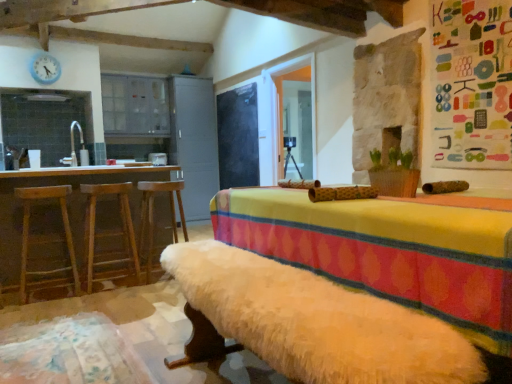
Question: Considering the relative positions of transparent glass door at center and wooden bar stool at left, marked as the 3th bar stool in a right-to-left arrangement, in the image provided, is transparent glass door at center behind wooden bar stool at left, marked as the 3th bar stool in a right-to-left arrangement,?

Choices:
 (A) yes
 (B) no

Answer: (A)

Question: Is wooden bar stool at left, the 1th bar stool from the left, completely or partially inside transparent glass door at center?

Choices:
 (A) yes
 (B) no

Answer: (B)

Question: Considering the relative sizes of transparent glass door at center and wooden bar stool at left, the 1th bar stool from the left, in the image provided, is transparent glass door at center thinner than wooden bar stool at left, the 1th bar stool from the left,?

Choices:
 (A) yes
 (B) no

Answer: (A)

Question: From the image's perspective, is transparent glass door at center under wooden bar stool at left, marked as the 3th bar stool in a right-to-left arrangement?

Choices:
 (A) yes
 (B) no

Answer: (B)

Question: Is transparent glass door at center outside of wooden bar stool at left, marked as the 3th bar stool in a right-to-left arrangement?

Choices:
 (A) no
 (B) yes

Answer: (B)

Question: Considering the positions of wooden bar stool at left, which is the 2th bar stool in left-to-right order, and fluffy white rug at lower left in the image, is wooden bar stool at left, which is the 2th bar stool in left-to-right order, bigger or smaller than fluffy white rug at lower left?

Choices:
 (A) big
 (B) small

Answer: (A)

Question: In terms of height, does wooden bar stool at left, which is the 2th bar stool in left-to-right order, look taller or shorter compared to fluffy white rug at lower left?

Choices:
 (A) short
 (B) tall

Answer: (B)

Question: Is wooden bar stool at left, arranged as the second bar stool when viewed from the right, spatially inside fluffy white rug at lower left, or outside of it?

Choices:
 (A) outside
 (B) inside

Answer: (A)

Question: Is point (99, 188) positioned closer to the camera than point (27, 382)?

Choices:
 (A) closer
 (B) farther

Answer: (B)

Question: Is point (177, 167) closer or farther from the camera than point (156, 192)?

Choices:
 (A) closer
 (B) farther

Answer: (B)

Question: Is brown wooden table at left inside or outside of wooden bar stool at left, arranged as the 1th bar stool when viewed from the right?

Choices:
 (A) outside
 (B) inside

Answer: (A)

Question: Considering the positions of brown wooden table at left and wooden bar stool at left, arranged as the 1th bar stool when viewed from the right, in the image, is brown wooden table at left taller or shorter than wooden bar stool at left, arranged as the 1th bar stool when viewed from the right,?

Choices:
 (A) short
 (B) tall

Answer: (B)

Question: Considering the relative positions of brown wooden table at left and wooden bar stool at left, arranged as the 1th bar stool when viewed from the right, in the image provided, is brown wooden table at left to the left or to the right of wooden bar stool at left, arranged as the 1th bar stool when viewed from the right,?

Choices:
 (A) right
 (B) left

Answer: (B)

Question: Relative to wooden bar stool at left, the 1th bar stool from the left, is wooden bar stool at left, arranged as the second bar stool when viewed from the right, in front or behind?

Choices:
 (A) behind
 (B) front

Answer: (A)

Question: From a real-world perspective, relative to wooden bar stool at left, the 1th bar stool from the left, is wooden bar stool at left, arranged as the second bar stool when viewed from the right, vertically above or below?

Choices:
 (A) above
 (B) below

Answer: (A)